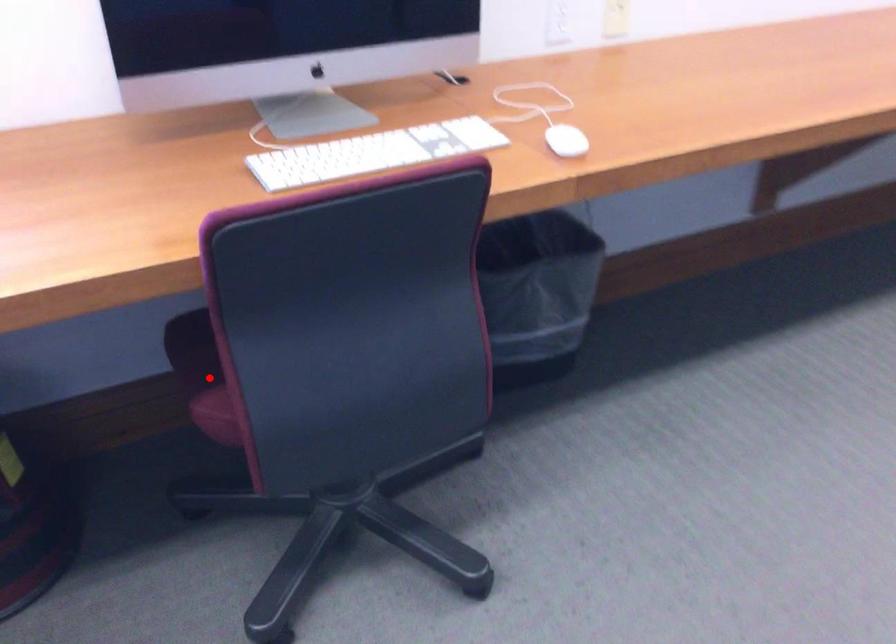
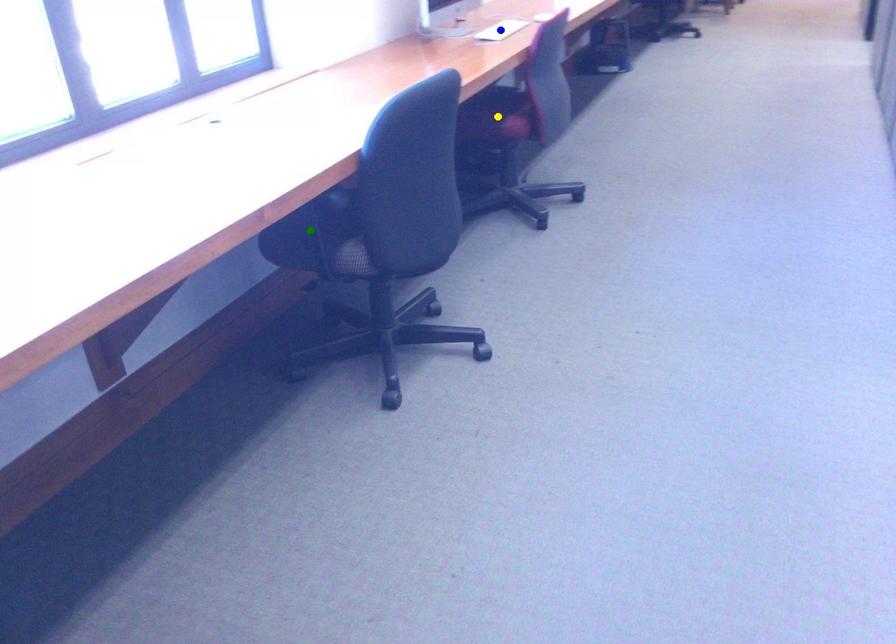
Question: I am providing you with two images of the same scene from different viewpoints. A red point is marked on the first image. You are given multiple points on the second image. In image 2, which mark is for the same physical point as the one in image 1?

Choices:
 (A) green point
 (B) yellow point
 (C) blue point

Answer: (B)